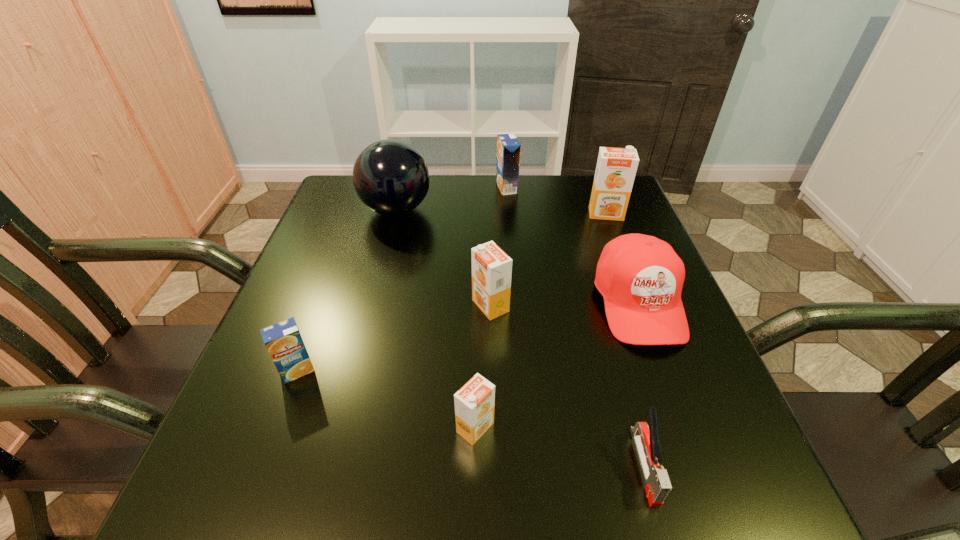
Find the location of `the third closest orange orange juice to the stapler`. the third closest orange orange juice to the stapler is located at coordinates (616, 168).

The width and height of the screenshot is (960, 540). Find the location of `free space that satisfies the following two spatial constraints: 1. on the side of the bowling ball with the finger holes; 2. on the front side of the second nearest orange juice`. free space that satisfies the following two spatial constraints: 1. on the side of the bowling ball with the finger holes; 2. on the front side of the second nearest orange juice is located at coordinates (355, 370).

Locate an element on the screen. The width and height of the screenshot is (960, 540). free space in the image that satisfies the following two spatial constraints: 1. on the back side of the tallest orange juice; 2. on the right side of the smallest orange orange juice is located at coordinates (477, 214).

The height and width of the screenshot is (540, 960). In order to click on free space that satisfies the following two spatial constraints: 1. on the side of the bowling ball with the finger holes; 2. on the left side of the rightmost orange juice in this screenshot , I will do `click(396, 214)`.